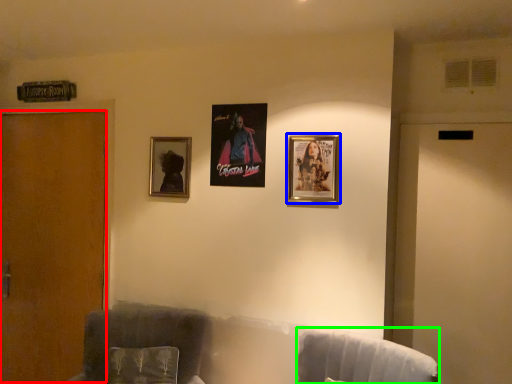
Question: Which object is positioned farthest from door (highlighted by a red box)? Select from picture frame (highlighted by a blue box) and swivel chair (highlighted by a green box).

Choices:
 (A) picture frame
 (B) swivel chair

Answer: (B)